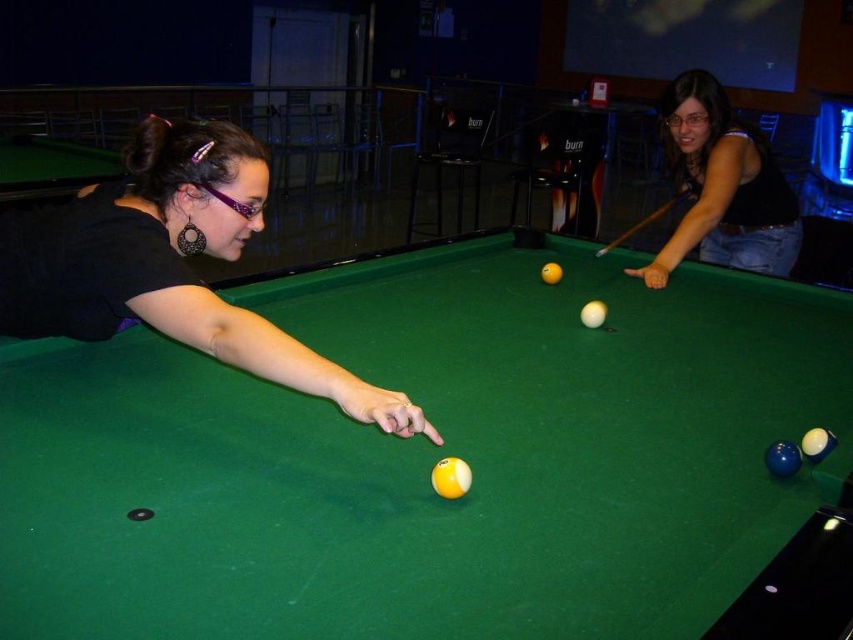
Where is `green felt billiard table at center`? green felt billiard table at center is located at coordinates (425, 458).

This screenshot has height=640, width=853. Describe the element at coordinates (425, 458) in the screenshot. I see `green felt billiard table at center` at that location.

Locate an element on the screen. The height and width of the screenshot is (640, 853). green felt billiard table at center is located at coordinates 425,458.

Who is more distant from viewer, (286, 385) or (722, 221)?

The point (722, 221) is more distant.

Is matte black shirt at left to the left of matte black tank top at upper right from the viewer's perspective?

Yes, matte black shirt at left is to the left of matte black tank top at upper right.

Is point (231, 138) farther from viewer compared to point (695, 186)?

No, it is in front of (695, 186).

Image resolution: width=853 pixels, height=640 pixels. I want to click on matte black shirt at left, so click(170, 266).

Can you confirm if green felt billiard table at center is bigger than matte black shirt at left?

Yes, green felt billiard table at center is bigger than matte black shirt at left.

Does green felt billiard table at center appear over matte black shirt at left?

Incorrect, green felt billiard table at center is not positioned above matte black shirt at left.

Which is in front, point (712, 513) or point (242, 248)?

Positioned in front is point (712, 513).

The height and width of the screenshot is (640, 853). I want to click on green felt billiard table at center, so click(x=425, y=458).